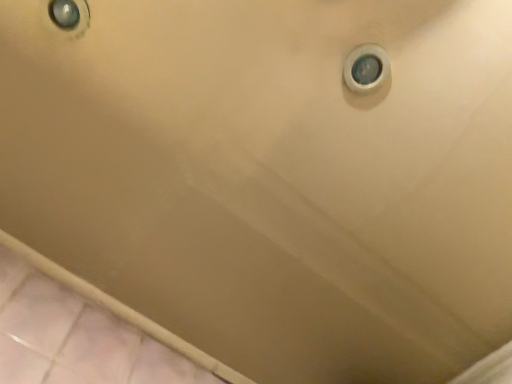
This screenshot has height=384, width=512. What are the coordinates of `white plastic hole at upper right` in the screenshot? It's located at (366, 68).

In order to face white plastic hole at upper right, should I rotate leftwards or rightwards?

You should look right and rotate roughly 14.649 degrees.

This screenshot has width=512, height=384. Describe the element at coordinates (366, 68) in the screenshot. I see `white plastic hole at upper right` at that location.

Locate an element on the screen. white plastic hole at upper right is located at coordinates (366, 68).